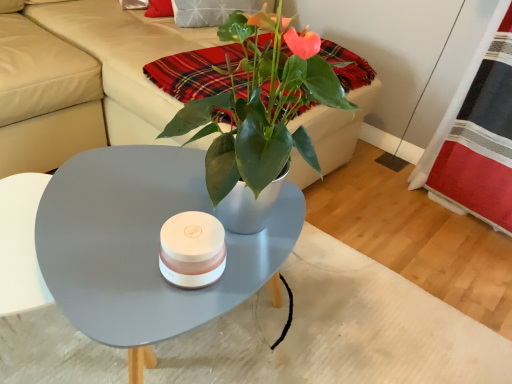
Question: Does red plaid fabric at right have a lesser height compared to matte gray coffee table at center?

Choices:
 (A) yes
 (B) no

Answer: (B)

Question: Is matte gray coffee table at center surrounded by red plaid fabric at right?

Choices:
 (A) no
 (B) yes

Answer: (A)

Question: Is red plaid fabric at right looking in the opposite direction of matte gray coffee table at center?

Choices:
 (A) no
 (B) yes

Answer: (A)

Question: From the image's perspective, is red plaid fabric at right over matte gray coffee table at center?

Choices:
 (A) no
 (B) yes

Answer: (B)

Question: From a real-world perspective, does red plaid fabric at right stand above matte gray coffee table at center?

Choices:
 (A) yes
 (B) no

Answer: (A)

Question: Does point (131, 296) appear closer or farther from the camera than point (224, 87)?

Choices:
 (A) farther
 (B) closer

Answer: (B)

Question: In the image, is matte gray coffee table at center on the left side or the right side of plaid fabric at upper center?

Choices:
 (A) right
 (B) left

Answer: (B)

Question: Relative to plaid fabric at upper center, is matte gray coffee table at center in front or behind?

Choices:
 (A) behind
 (B) front

Answer: (B)

Question: From a real-world perspective, is matte gray coffee table at center physically located above or below plaid fabric at upper center?

Choices:
 (A) below
 (B) above

Answer: (A)

Question: In the image, is plaid fabric at upper center positioned in front of or behind matte gray coffee table at center?

Choices:
 (A) behind
 (B) front

Answer: (A)

Question: Choose the correct answer: Is plaid fabric at upper center inside matte gray coffee table at center or outside it?

Choices:
 (A) inside
 (B) outside

Answer: (B)

Question: Would you say plaid fabric at upper center is to the left or to the right of matte gray coffee table at center in the picture?

Choices:
 (A) right
 (B) left

Answer: (A)

Question: From the image's perspective, relative to matte gray coffee table at center, is plaid fabric at upper center above or below?

Choices:
 (A) above
 (B) below

Answer: (A)

Question: Does point (53, 74) appear closer or farther from the camera than point (479, 66)?

Choices:
 (A) farther
 (B) closer

Answer: (B)

Question: Looking at their shapes, would you say beige leather couch at upper center is wider or thinner than red plaid fabric at right?

Choices:
 (A) thin
 (B) wide

Answer: (B)